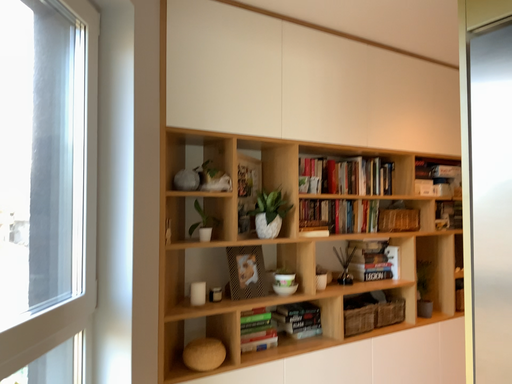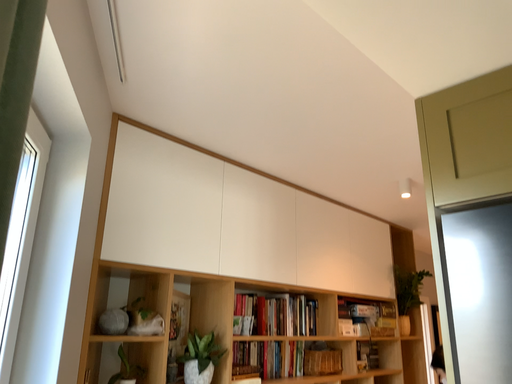
Question: How did the camera likely rotate when shooting the video?

Choices:
 (A) rotated upward
 (B) rotated downward

Answer: (A)